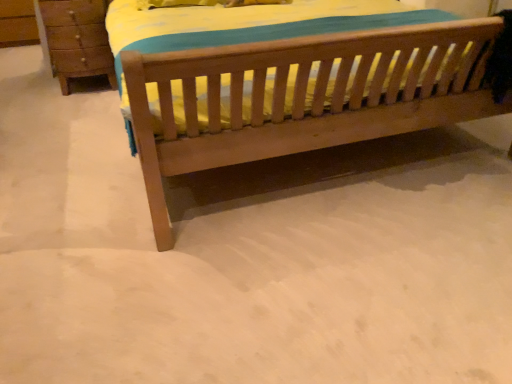
Question: Visually, is wooden chest of drawers at left positioned to the left or to the right of wooden bed at center?

Choices:
 (A) left
 (B) right

Answer: (A)

Question: From a real-world perspective, is wooden chest of drawers at left physically located above or below wooden bed at center?

Choices:
 (A) below
 (B) above

Answer: (B)

Question: Which is correct: wooden chest of drawers at left is inside wooden bed at center, or outside of it?

Choices:
 (A) outside
 (B) inside

Answer: (A)

Question: Looking at their shapes, would you say wooden bed at center is wider or thinner than wooden chest of drawers at left?

Choices:
 (A) thin
 (B) wide

Answer: (B)

Question: In the image, is wooden bed at center positioned in front of or behind wooden chest of drawers at left?

Choices:
 (A) front
 (B) behind

Answer: (A)

Question: Considering the positions of wooden bed at center and wooden chest of drawers at left in the image, is wooden bed at center taller or shorter than wooden chest of drawers at left?

Choices:
 (A) short
 (B) tall

Answer: (A)

Question: Which is correct: wooden bed at center is inside wooden chest of drawers at left, or outside of it?

Choices:
 (A) inside
 (B) outside

Answer: (B)